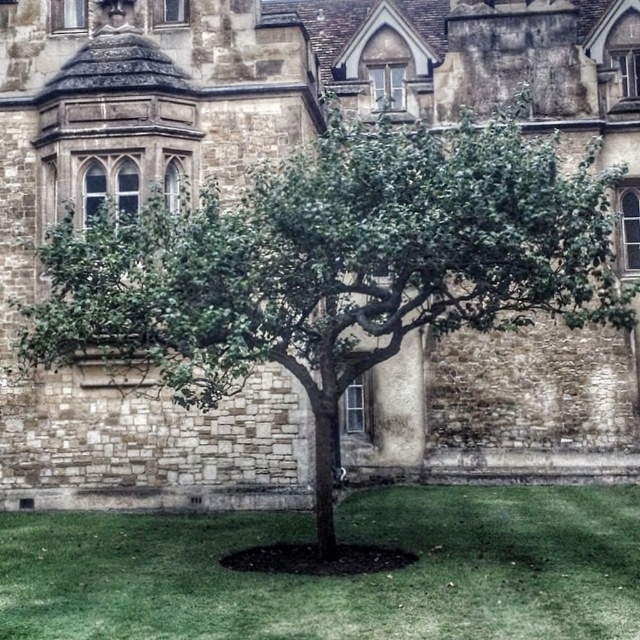
You are a landscape architect designing a walking path between the green leafy tree at center and the green grass at center. If the path is 8 meters long, will it reach from one to the other?

The distance between the green leafy tree at center and the green grass at center is 9.24 meters, so an 8 meter path would not be long enough to connect them.

You are a gardener who needs to mow the lawn. You see the green leafy tree at center and the green grass at center. Which area should you avoid mowing to protect the tree?

You should avoid mowing near the green leafy tree at center because it is larger in size than the green grass at center, indicating it requires more space and protection.